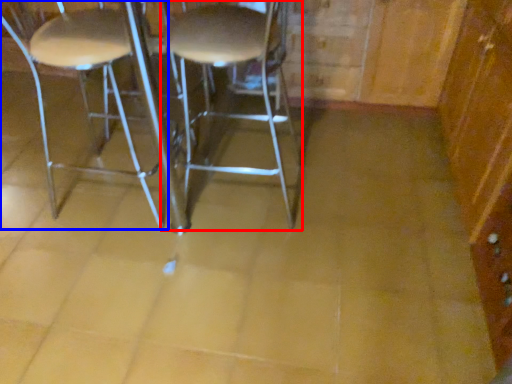
Question: Which object is further to the camera taking this photo, stool (highlighted by a red box) or chair (highlighted by a blue box)?

Choices:
 (A) stool
 (B) chair

Answer: (B)